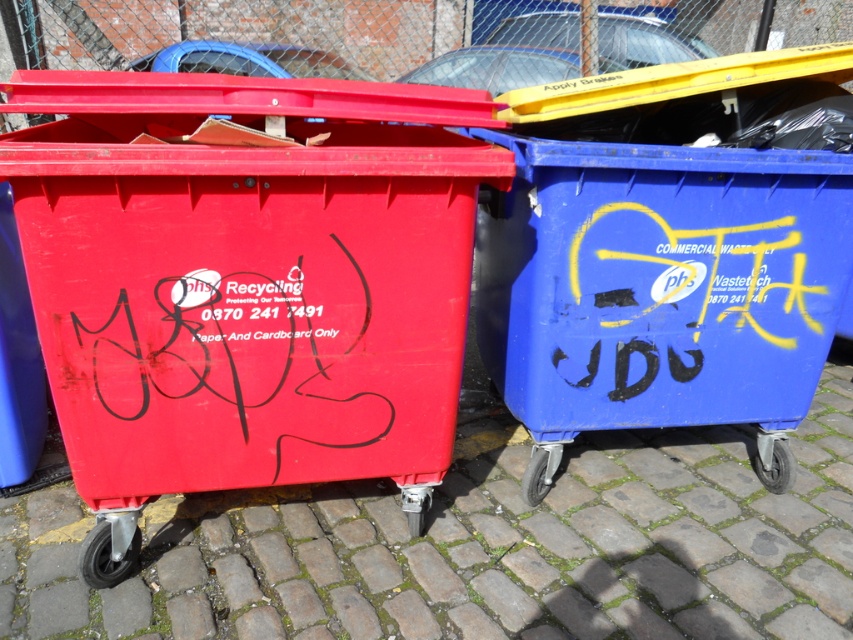
You are standing in front of two recycling bins. The first is a matte plastic recycling bin at left, and the second is a matte plastic bin at center. Which bin is nearer to you?

The matte plastic recycling bin at left is closer to the viewer than the matte plastic bin at center, so the matte plastic recycling bin at left is nearer to you.

You are designing a layout for a new outdoor area and need to place the matte plastic recycling bin at left and the cobblestone pavement at center. Based on the existing image, which object takes up more space in the scene?

The cobblestone pavement at center occupies more space than the matte plastic recycling bin at left according to the description.

You are standing in front of two recycling bins on a cobblestone pavement at center. You want to call the recycling company for the bin on the left. What phone number should you dial?

The red bin on the left has the contact number 0870 241 7491 printed on it, so you should dial 0870 241 7491.